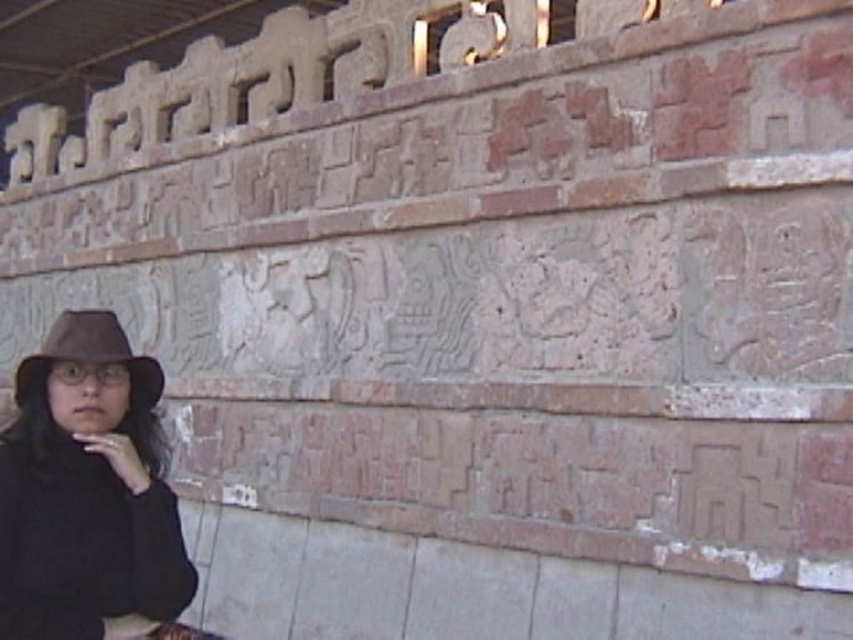
You are a photographer aiming to capture the ancient stone wall with its carvings. You want to ensure that the matte brown hat at left does not block the view of the carvings. Based on its position at point (86, 490), can you determine if the matte brown hat at left is positioned to the left or right of the carvings on the wall?

The matte brown hat at left is located at point (86, 490), which is to the left of the carvings on the wall.